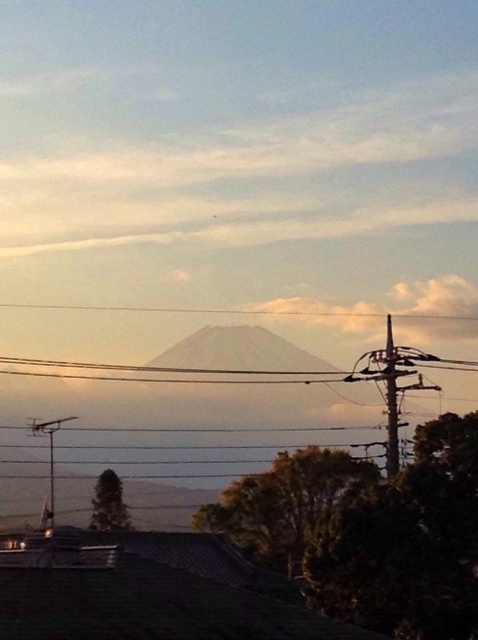
Question: Which object appears farthest from the camera in this image?

Choices:
 (A) metallic gray telegraph pole at left
 (B) metallic wire at right

Answer: (A)

Question: Which of these objects is positioned closest to the metallic wire at right?

Choices:
 (A) white fluffy cloud at upper center
 (B) metallic gray telegraph pole at left

Answer: (B)

Question: Does white fluffy cloud at upper center come in front of metallic gray telegraph pole at left?

Choices:
 (A) yes
 (B) no

Answer: (B)

Question: Which of the following is the closest to the observer?

Choices:
 (A) metallic wire at right
 (B) white fluffy cloud at upper center
 (C) metallic gray telegraph pole at left

Answer: (A)

Question: Can you confirm if metallic wire at right is positioned to the right of metallic gray telegraph pole at left?

Choices:
 (A) no
 (B) yes

Answer: (B)

Question: Can you confirm if metallic wire at right is wider than metallic gray telegraph pole at left?

Choices:
 (A) yes
 (B) no

Answer: (B)